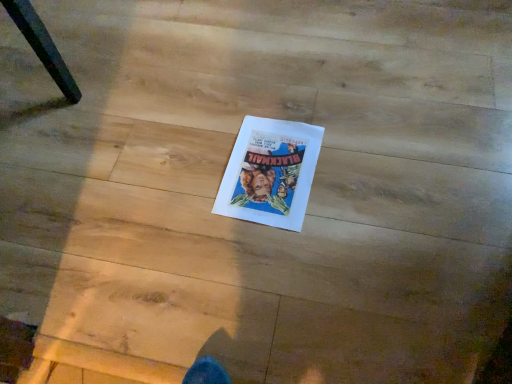
The height and width of the screenshot is (384, 512). What do you see at coordinates (270, 173) in the screenshot?
I see `matte paper poster at center` at bounding box center [270, 173].

Where is `matte paper poster at center`? matte paper poster at center is located at coordinates (270, 173).

Identify the location of matte paper poster at center. This screenshot has height=384, width=512. (270, 173).